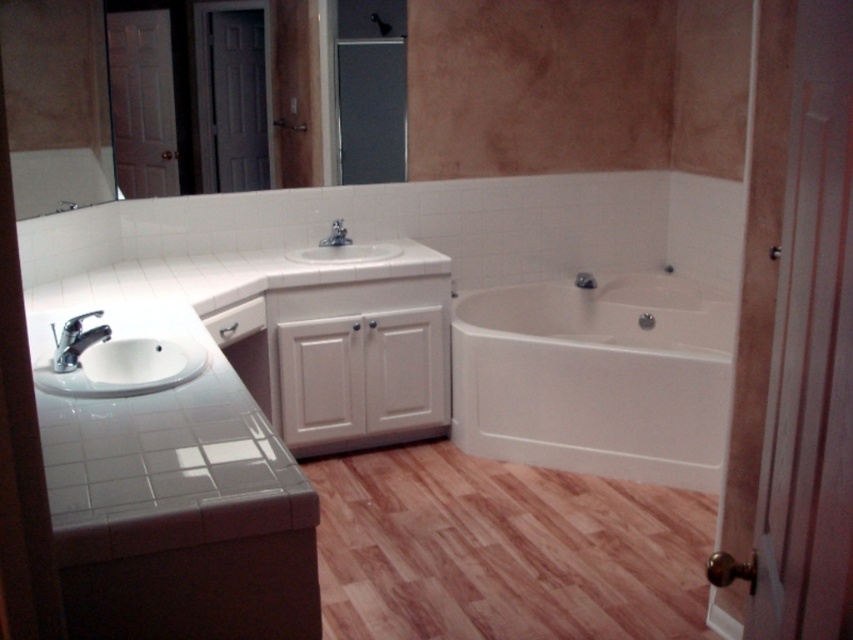
Question: Is white glossy sink at left to the left of matte silver faucet at sink left from the viewer's perspective?

Choices:
 (A) no
 (B) yes

Answer: (A)

Question: Can you confirm if matte silver faucet at sink left is smaller than matte silver faucet at center?

Choices:
 (A) yes
 (B) no

Answer: (B)

Question: Estimate the real-world distances between objects in this image. Which object is closer to the white glossy sink at left?

Choices:
 (A) white glossy sink at center
 (B) matte silver faucet at sink left
 (C) matte silver faucet at center
 (D) white glossy bathtub at center

Answer: (B)

Question: Which object is closer to the camera taking this photo?

Choices:
 (A) white glossy sink at left
 (B) matte silver faucet at sink left

Answer: (A)

Question: In this image, where is white glossy bathtub at center located relative to white glossy sink at left?

Choices:
 (A) below
 (B) above

Answer: (A)

Question: Which of the following is the closest to the observer?

Choices:
 (A) white glossy sink at center
 (B) white glossy bathtub at center

Answer: (B)